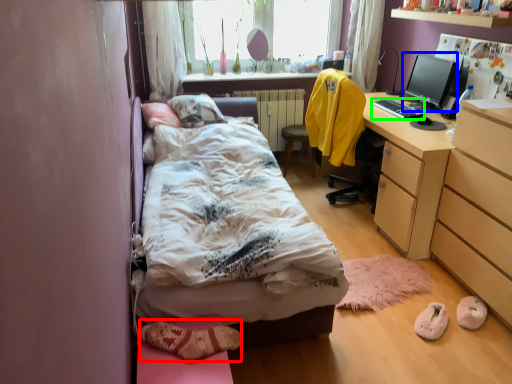
Question: Considering the real-world distances, which object is farthest from shoe (highlighted by a red box)? computer monitor (highlighted by a blue box) or desktop (highlighted by a green box)?

Choices:
 (A) computer monitor
 (B) desktop

Answer: (A)